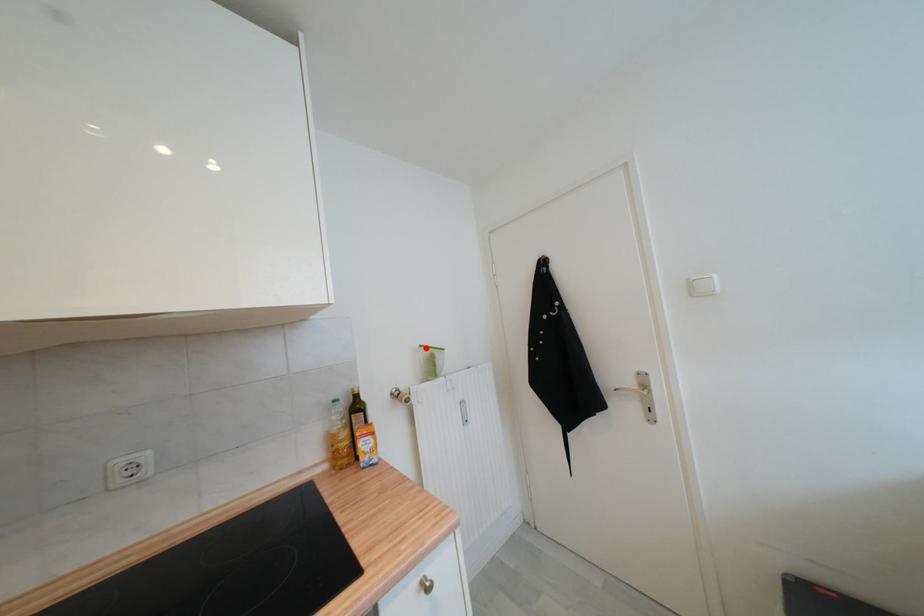
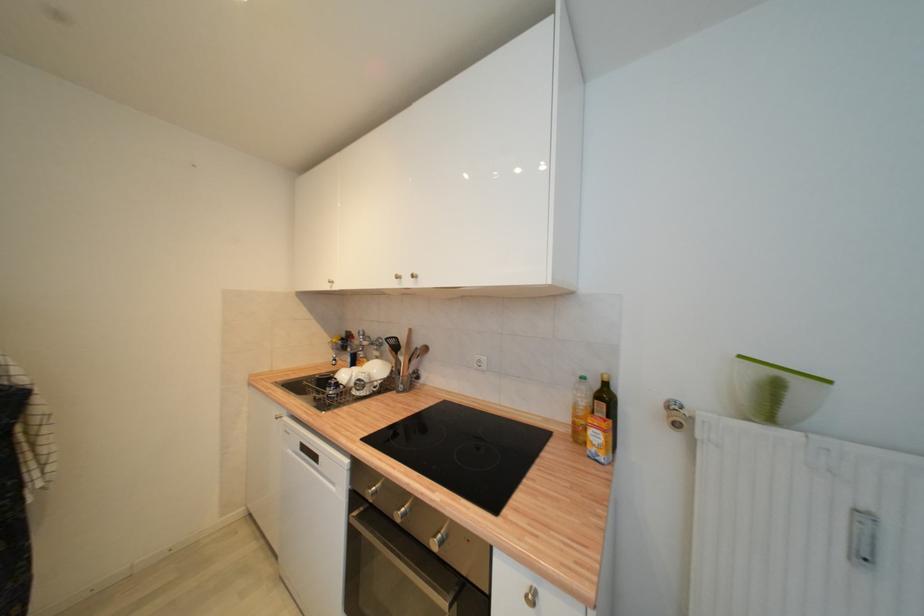
Locate, in the second image, the point that corresponds to the highlighted location in the first image.

(746, 359)